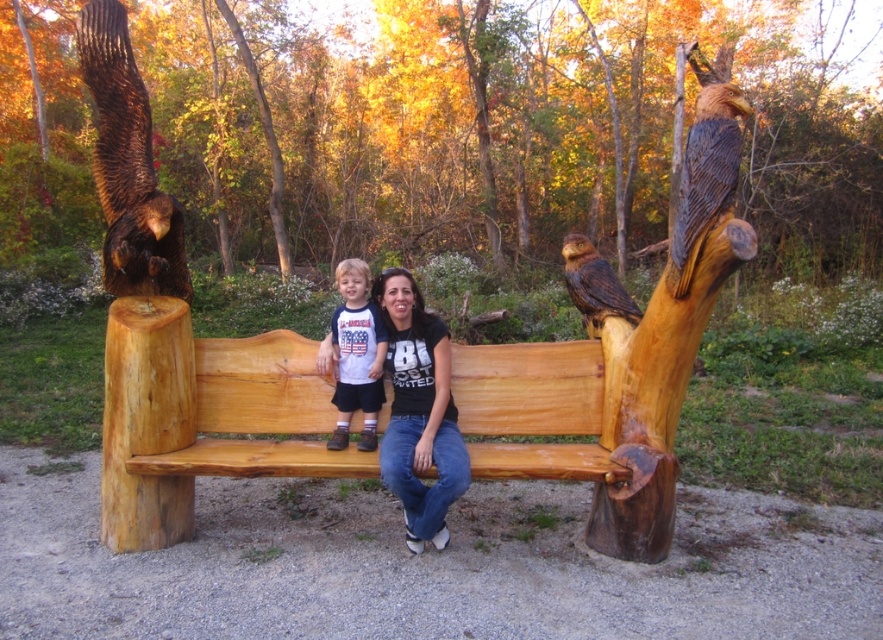
Question: Does brown wood carving of owl at upper right appear on the left side of matte white shirt at center?

Choices:
 (A) no
 (B) yes

Answer: (A)

Question: Among these objects, which one is farthest from the camera?

Choices:
 (A) brown wood carving of owl at left
 (B) brown wood carving of owl at upper right

Answer: (A)

Question: Which point is farther to the camera?

Choices:
 (A) (364, 300)
 (B) (598, 292)
 (C) (695, 138)
 (D) (129, 227)

Answer: (A)

Question: Which point is closer to the camera taking this photo?

Choices:
 (A) (140, 284)
 (B) (446, 352)

Answer: (A)

Question: Is brown wood carving of owl at left positioned before matte white shirt at center?

Choices:
 (A) no
 (B) yes

Answer: (B)

Question: Can you confirm if natural wood bench at center is positioned to the right of brown wood carving of owl at left?

Choices:
 (A) yes
 (B) no

Answer: (A)